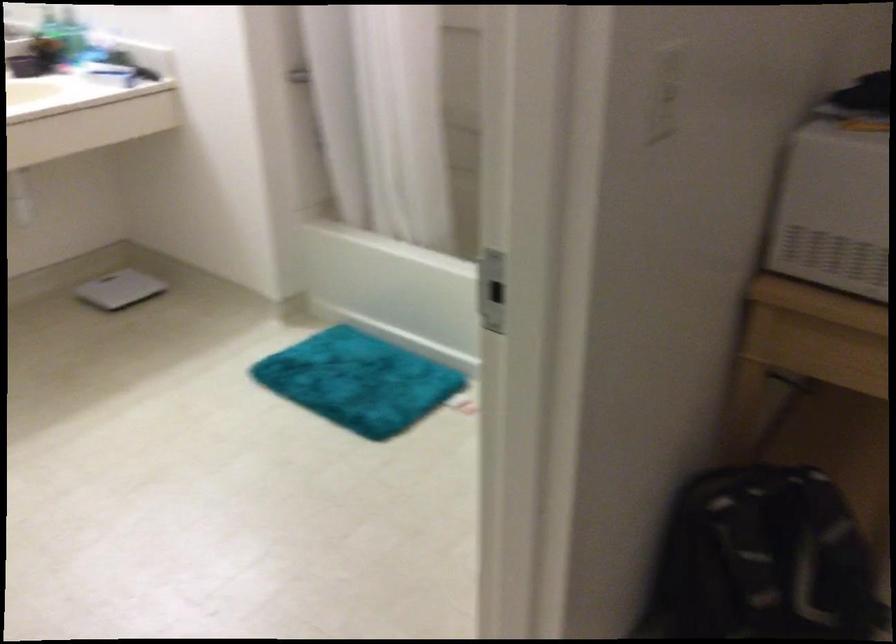
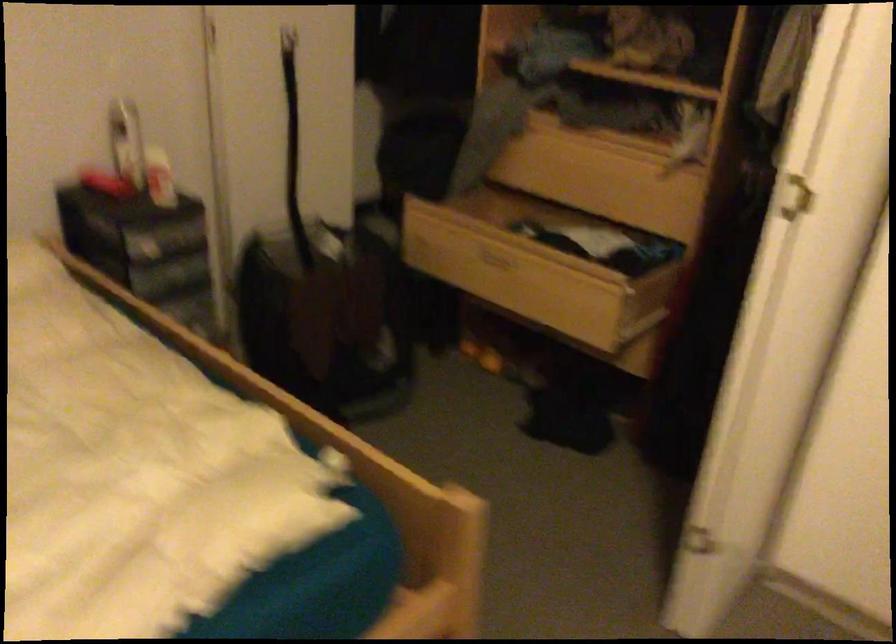
Question: I am providing you with two images of the same scene from different viewpoints. After the viewpoint changes to image2, which objects are now occluded?

Choices:
 (A) white bathroom scale
 (B) light switch rocker
 (C) open wooden drawer
 (D) white door handle

Answer: (A)